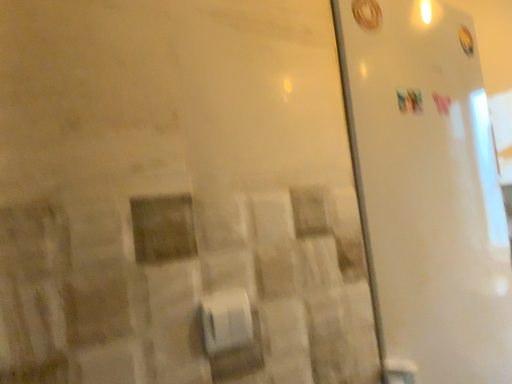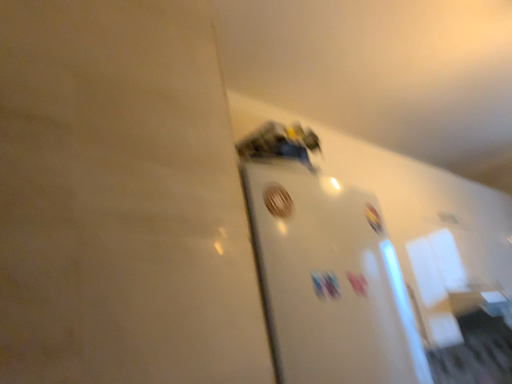
Question: How did the camera likely rotate when shooting the video?

Choices:
 (A) rotated left
 (B) rotated right

Answer: (B)